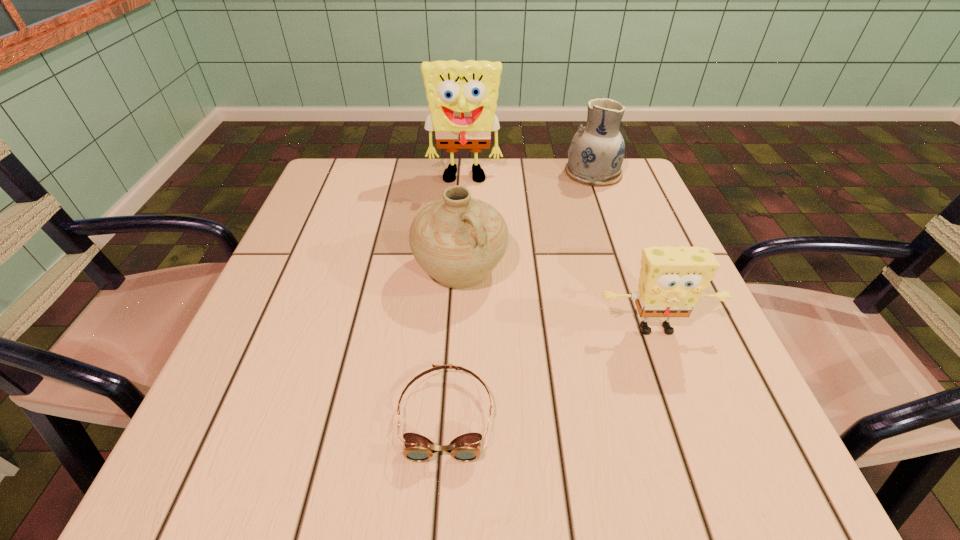
At what (x,y) coordinates should I click in order to perform the action: click on vacant space located 0.400m on the left of the right pottery. Please return your answer as a coordinate pair (x, y). The height and width of the screenshot is (540, 960). Looking at the image, I should click on (414, 173).

Locate an element on the screen. This screenshot has height=540, width=960. free location located on the left of the nearer pottery is located at coordinates pyautogui.click(x=346, y=269).

Where is `vacant space situated 0.180m on the face of the nearer sponge`? The height and width of the screenshot is (540, 960). vacant space situated 0.180m on the face of the nearer sponge is located at coordinates (699, 447).

The height and width of the screenshot is (540, 960). In order to click on sponge located at the far edge in this screenshot , I will do `click(462, 97)`.

In order to click on pottery that is at the far edge in this screenshot , I will do `click(595, 155)`.

The image size is (960, 540). I want to click on object present at the near edge, so click(x=465, y=448).

Locate an element on the screen. pottery at the right edge is located at coordinates (595, 155).

Identify the location of sponge at the right edge. tap(672, 280).

Locate an element on the screen. The width and height of the screenshot is (960, 540). object that is at the far right corner is located at coordinates (595, 155).

In the image, there is a desktop. At what (x,y) coordinates should I click in order to perform the action: click on vacant space at the far edge. Please return your answer as a coordinate pair (x, y). Image resolution: width=960 pixels, height=540 pixels. Looking at the image, I should click on (550, 189).